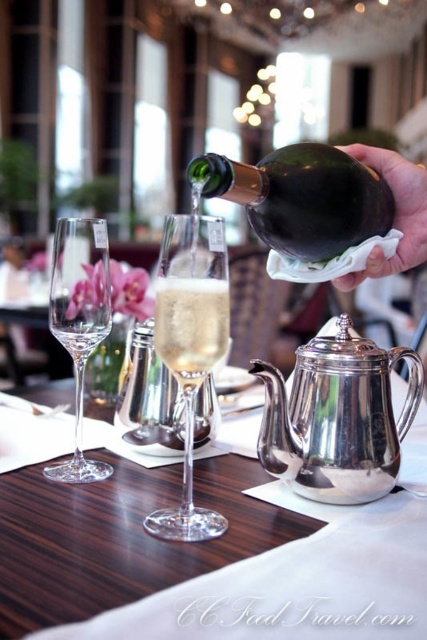
The height and width of the screenshot is (640, 427). Describe the element at coordinates (301, 196) in the screenshot. I see `green glass bottle at upper center` at that location.

Is green glass bottle at upper center positioned at the back of clear glass wine glass at left?

No, it is not.

At what (x,y) coordinates should I click in order to perform the action: click on green glass bottle at upper center. Please return your answer as a coordinate pair (x, y). The image size is (427, 640). Looking at the image, I should click on (301, 196).

Is silver metallic teapot at center wider than clear glass champagne at center?

Indeed, silver metallic teapot at center has a greater width compared to clear glass champagne at center.

Who is shorter, silver metallic teapot at center or clear glass champagne at center?

With less height is silver metallic teapot at center.

Locate an element on the screen. The height and width of the screenshot is (640, 427). silver metallic teapot at center is located at coordinates (295, 588).

Between silver/metallic teapot at center and clear glass wine glass at center, which one appears on the left side from the viewer's perspective?

clear glass wine glass at center

Between point (321, 404) and point (201, 532), which one is positioned in front?

Point (201, 532) is more forward.

Is point (325, 467) behind point (228, 330)?

Yes, point (325, 467) is behind point (228, 330).

The width and height of the screenshot is (427, 640). What are the coordinates of `silver/metallic teapot at center` in the screenshot? It's located at (336, 419).